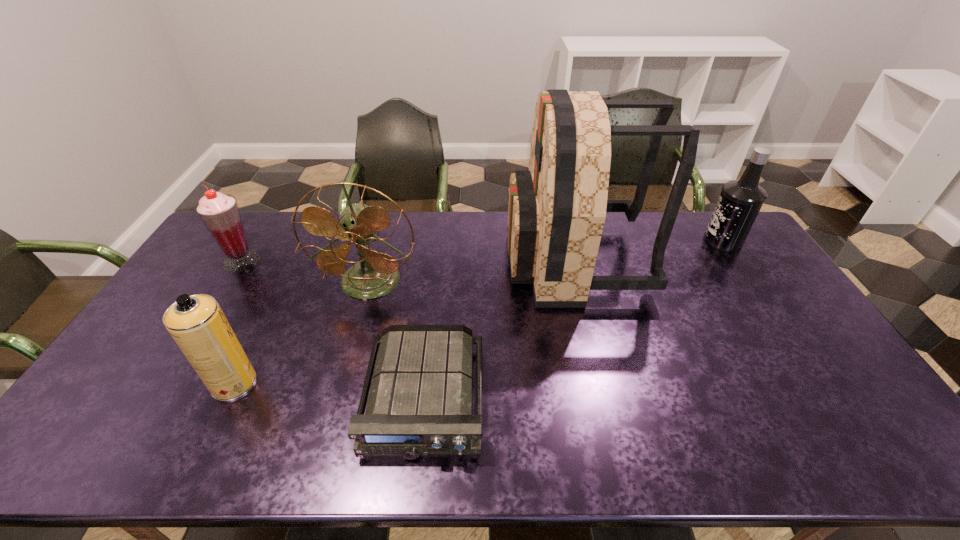
Identify the location of object present at the right edge. coord(740,201).

At what (x,y) coordinates should I click in order to perform the action: click on object located in the far right corner section of the desktop. Please return your answer as a coordinate pair (x, y). Image resolution: width=960 pixels, height=540 pixels. Looking at the image, I should click on (740, 201).

Locate an element on the screen. This screenshot has width=960, height=540. free space at the far edge of the desktop is located at coordinates click(457, 249).

Find the location of a particular element. This screenshot has height=540, width=960. free region at the near edge of the desktop is located at coordinates (714, 430).

Find the location of a particular element. This screenshot has height=540, width=960. vacant space at the far left corner is located at coordinates (274, 212).

Locate an element on the screen. vacant area at the far right corner of the desktop is located at coordinates 690,215.

Where is `empty space between the liquor and the radio receiver`? Image resolution: width=960 pixels, height=540 pixels. empty space between the liquor and the radio receiver is located at coordinates (573, 319).

The width and height of the screenshot is (960, 540). I want to click on vacant point located between the radio receiver and the smoothie, so click(333, 329).

Image resolution: width=960 pixels, height=540 pixels. Identify the location of vacant point located between the aerosol can and the tallest object. (404, 321).

You are a GUI agent. You are given a task and a screenshot of the screen. Output one action in this format:
    pyautogui.click(x=<x>, y=<y>)
    Task: Click on the free spot between the second object from right to left and the aerosol can
    
    Given the screenshot: What is the action you would take?
    tap(404, 321)